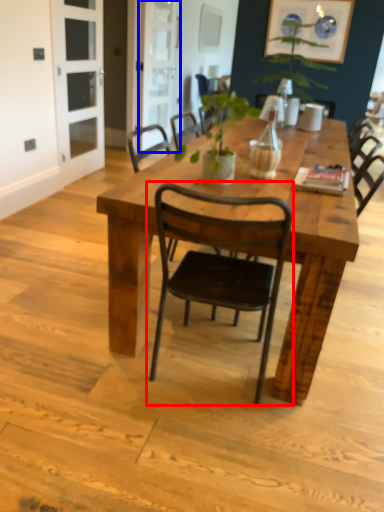
Question: Which point is further to the camera, chair (highlighted by a red box) or screen door (highlighted by a blue box)?

Choices:
 (A) chair
 (B) screen door

Answer: (B)